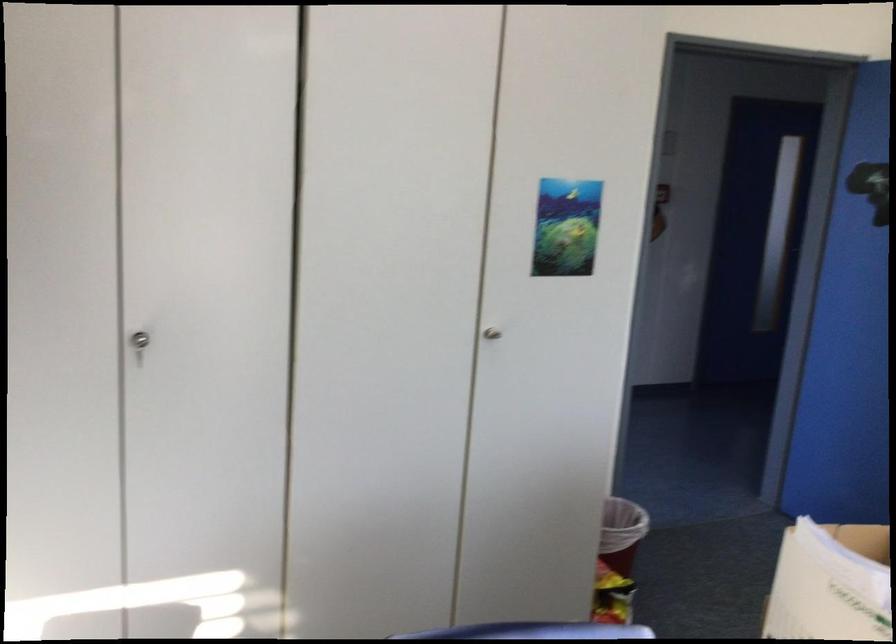
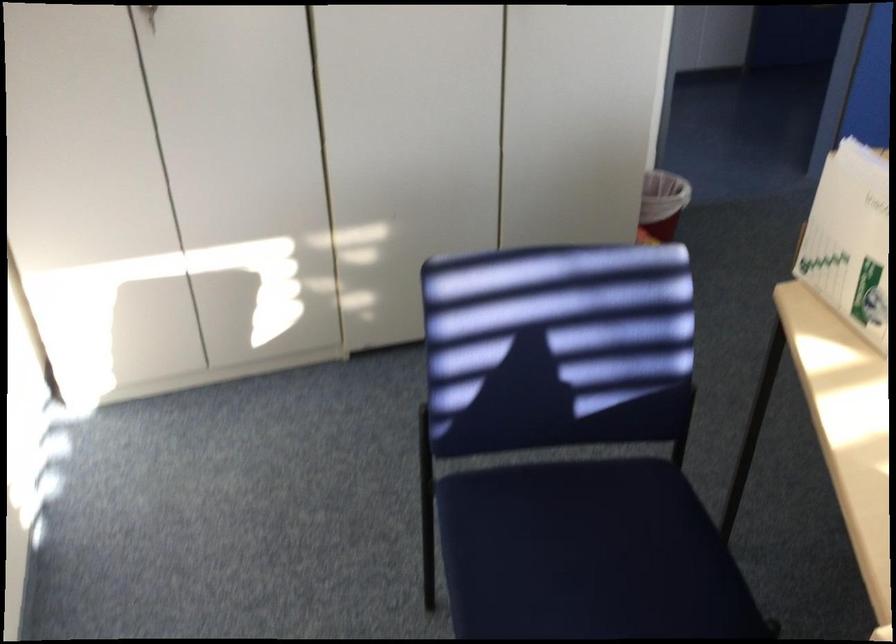
Locate, in the second image, the point that corresponds to pixel 632 533 in the first image.

(661, 203)